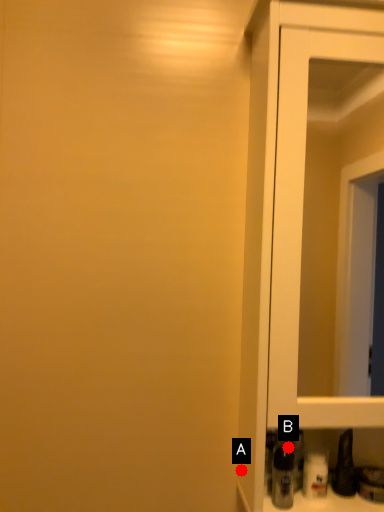
Question: Two points are circled on the image, labeled by A and B beside each circle. Which point is closer to the camera?

Choices:
 (A) A is closer
 (B) B is closer

Answer: (B)